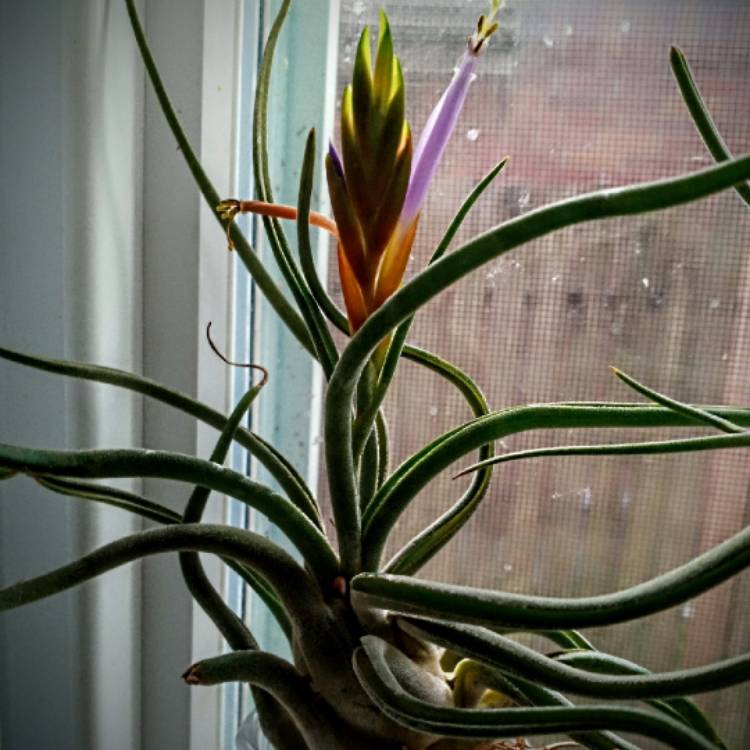
Where is `wall`? wall is located at coordinates (157, 298).